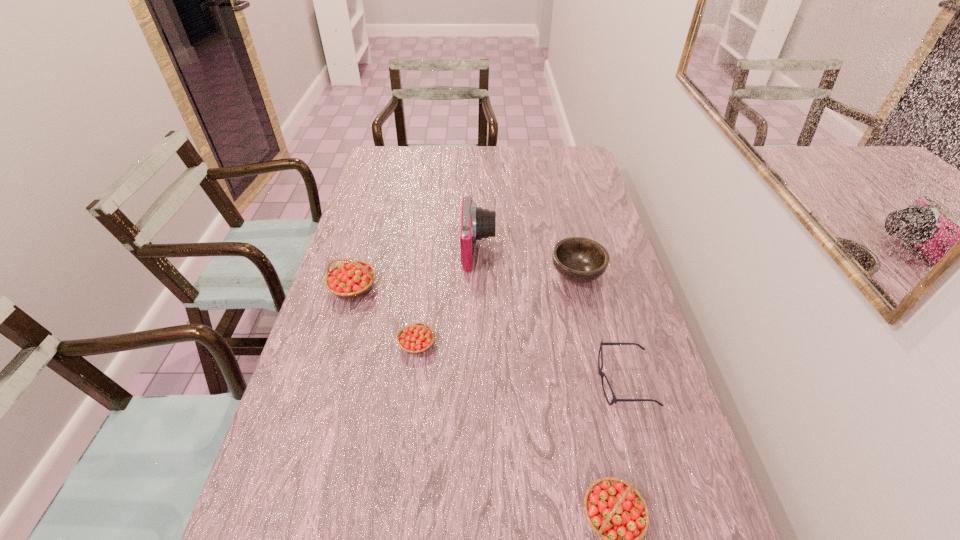
The image size is (960, 540). In order to click on the leftmost object in this screenshot , I will do `click(353, 278)`.

Locate an element on the screen. the leftmost strawberry is located at coordinates (353, 278).

Find the location of a particular element. the second strawberry from left to right is located at coordinates (415, 338).

Identify the location of the shortest strawberry. The image size is (960, 540). (415, 338).

Identify the location of camera. Image resolution: width=960 pixels, height=540 pixels. (476, 223).

This screenshot has width=960, height=540. I want to click on the third object from left to right, so click(x=476, y=223).

Locate an element on the screen. The height and width of the screenshot is (540, 960). bowl is located at coordinates (577, 259).

At what (x,y) coordinates should I click in order to perform the action: click on spectacles. Please return your answer as a coordinate pair (x, y). Looking at the image, I should click on (602, 374).

This screenshot has height=540, width=960. I want to click on free space located on the right of the fifth shortest object, so pos(442,287).

You are a GUI agent. You are given a task and a screenshot of the screen. Output one action in this format:
    pyautogui.click(x=<x>, y=<y>)
    Task: Click on the free location located 0.370m on the right of the second strawberry from left to right
    
    Given the screenshot: What is the action you would take?
    pyautogui.click(x=577, y=344)